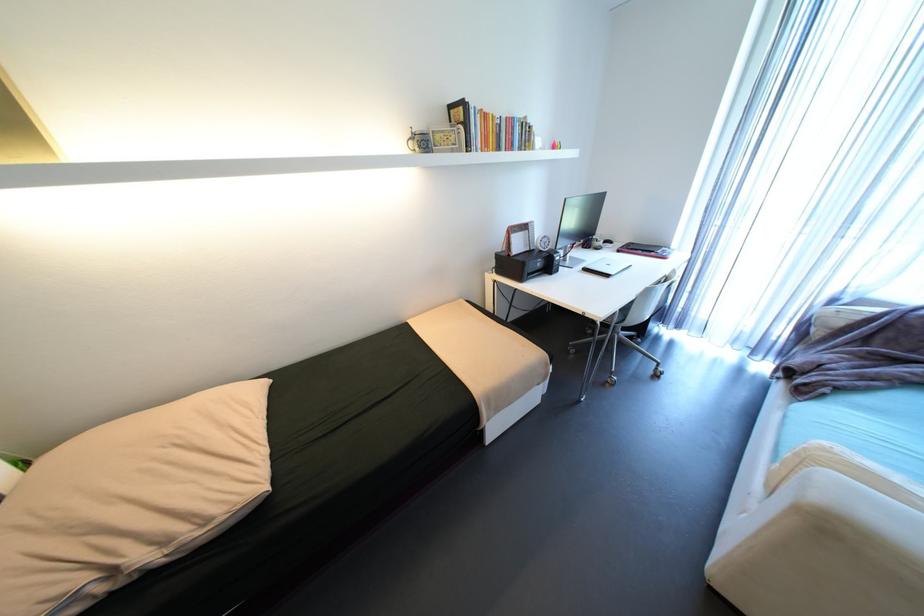
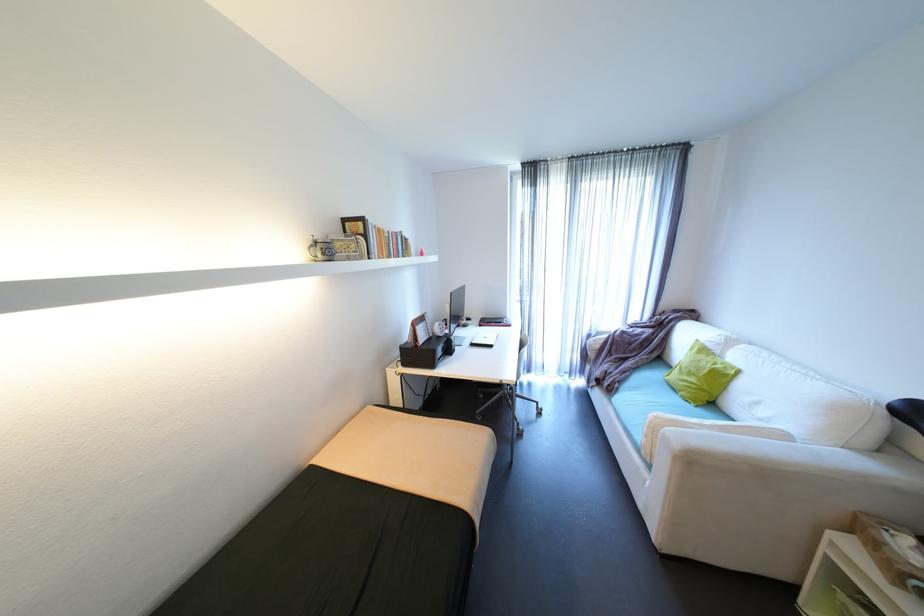
Find the pixel in the second image that matches (660,252) in the first image.

(508, 323)